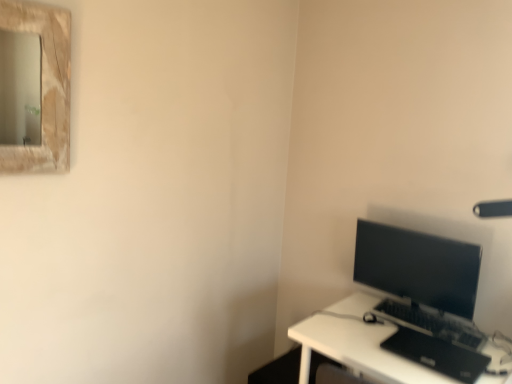
Describe the element at coordinates (437, 354) in the screenshot. I see `black matte laptop at lower right` at that location.

Image resolution: width=512 pixels, height=384 pixels. I want to click on matte black monitor at right, so point(418,267).

Is white plastic desk at lower right closer to the viewer compared to black matte laptop at lower right?

Yes, it is.

In the image, is white plastic desk at lower right on the left side or the right side of black matte laptop at lower right?

white plastic desk at lower right is positioned on black matte laptop at lower right's left side.

Is white plastic desk at lower right taller than black matte laptop at lower right?

Indeed, white plastic desk at lower right has a greater height compared to black matte laptop at lower right.

From a real-world perspective, which object stands above the other?

black matte laptop at lower right is physically above.

From the image's perspective, is matte black monitor at right under black plastic keyboard at lower right?

Incorrect, from the image's perspective, matte black monitor at right is higher than black plastic keyboard at lower right.

Is matte black monitor at right oriented towards black plastic keyboard at lower right?

Yes, matte black monitor at right faces towards black plastic keyboard at lower right.

From a real-world perspective, does matte black monitor at right sit lower than black plastic keyboard at lower right?

No, from a real-world perspective, matte black monitor at right is not under black plastic keyboard at lower right.

Considering the sizes of objects black plastic keyboard at lower right and white plastic desk at lower right in the image provided, who is wider, black plastic keyboard at lower right or white plastic desk at lower right?

white plastic desk at lower right.

Could you tell me if black plastic keyboard at lower right is turned towards white plastic desk at lower right?

No, black plastic keyboard at lower right is not oriented towards white plastic desk at lower right.

Does point (385, 311) come farther from viewer compared to point (344, 316)?

Yes, point (385, 311) is behind point (344, 316).

Is black plastic keyboard at lower right not near white plastic desk at lower right?

No, black plastic keyboard at lower right is not far away from white plastic desk at lower right.

Between point (451, 339) and point (450, 257), which one is positioned behind?

Point (450, 257)

From a real-world perspective, who is located lower, black plastic keyboard at lower right or matte black monitor at right?

In real-world perspective, black plastic keyboard at lower right is lower.

From the image's perspective, would you say black plastic keyboard at lower right is shown under matte black monitor at right?

Yes, from the image's perspective, black plastic keyboard at lower right is below matte black monitor at right.

Where is `computer monitor located above the black matte laptop at lower right (from the image's perspective)`? This screenshot has width=512, height=384. computer monitor located above the black matte laptop at lower right (from the image's perspective) is located at coordinates (418, 267).

Is matte black monitor at right not near black matte laptop at lower right?

matte black monitor at right is near black matte laptop at lower right, not far away.

From a real-world perspective, between matte black monitor at right and black matte laptop at lower right, who is vertically higher?

matte black monitor at right is physically above.

Is point (458, 264) positioned in front of point (440, 340)?

No, it is behind (440, 340).

Which object is positioned more to the left, black plastic keyboard at lower right or black matte laptop at lower right?

Positioned to the left is black matte laptop at lower right.

In the image, is black plastic keyboard at lower right positioned in front of or behind black matte laptop at lower right?

black plastic keyboard at lower right is behind black matte laptop at lower right.

From the picture: Does black plastic keyboard at lower right have a greater height compared to black matte laptop at lower right?

Yes.

Is black matte laptop at lower right completely or partially inside black plastic keyboard at lower right?

Definitely not — black matte laptop at lower right is not inside black plastic keyboard at lower right.

Can you see black matte laptop at lower right touching black plastic keyboard at lower right?

No, black matte laptop at lower right is not with black plastic keyboard at lower right.

Is black matte laptop at lower right bigger or smaller than black plastic keyboard at lower right?

In the image, black matte laptop at lower right appears to be smaller than black plastic keyboard at lower right.

Which object is positioned more to the left, black matte laptop at lower right or black plastic keyboard at lower right?

Positioned to the left is black matte laptop at lower right.

I want to click on laptop on the left of black plastic keyboard at lower right, so click(437, 354).

The height and width of the screenshot is (384, 512). There is a white plastic desk at lower right. In order to click on laptop above it (from a real-world perspective) in this screenshot , I will do `click(437, 354)`.

Find the location of `computer keyboard to the right of matte black monitor at right`. computer keyboard to the right of matte black monitor at right is located at coordinates click(432, 323).

Considering their positions, is white plastic desk at lower right positioned further to black plastic keyboard at lower right than matte black monitor at right?

white plastic desk at lower right is positioned further to the anchor black plastic keyboard at lower right.

Which object lies further to the anchor point matte black monitor at right, black plastic keyboard at lower right or white plastic desk at lower right?

Based on the image, white plastic desk at lower right appears to be further to matte black monitor at right.

Looking at the image, which one is located further to white plastic desk at lower right, matte black monitor at right or black matte laptop at lower right?

matte black monitor at right is positioned further to the anchor white plastic desk at lower right.

Consider the image. Based on their spatial positions, is black plastic keyboard at lower right or white plastic desk at lower right further from black matte laptop at lower right?

Among the two, white plastic desk at lower right is located further to black matte laptop at lower right.

Considering their positions, is white plastic desk at lower right positioned further to black matte laptop at lower right than black plastic keyboard at lower right?

white plastic desk at lower right lies further to black matte laptop at lower right than the other object.

When comparing their distances from matte black monitor at right, does black matte laptop at lower right or white plastic desk at lower right seem further?

black matte laptop at lower right is further to matte black monitor at right.

When comparing their distances from black plastic keyboard at lower right, does matte black monitor at right or black matte laptop at lower right seem closer?

black matte laptop at lower right is closer to black plastic keyboard at lower right.

When comparing their distances from matte black monitor at right, does black plastic keyboard at lower right or black matte laptop at lower right seem closer?

black plastic keyboard at lower right.

At what (x,y) coordinates should I click in order to perform the action: click on computer keyboard located between white plastic desk at lower right and matte black monitor at right in the depth direction. Please return your answer as a coordinate pair (x, y). This screenshot has height=384, width=512. Looking at the image, I should click on (432, 323).

You are a GUI agent. You are given a task and a screenshot of the screen. Output one action in this format:
    pyautogui.click(x=<x>, y=<y>)
    Task: Click on the computer keyboard located between black matte laptop at lower right and matte black monitor at right in the depth direction
    
    Given the screenshot: What is the action you would take?
    pyautogui.click(x=432, y=323)

Find the location of a particular element. laptop between matte black monitor at right and white plastic desk at lower right vertically is located at coordinates (437, 354).

Locate an element on the screen. This screenshot has height=384, width=512. laptop between white plastic desk at lower right and black plastic keyboard at lower right along the z-axis is located at coordinates (437, 354).